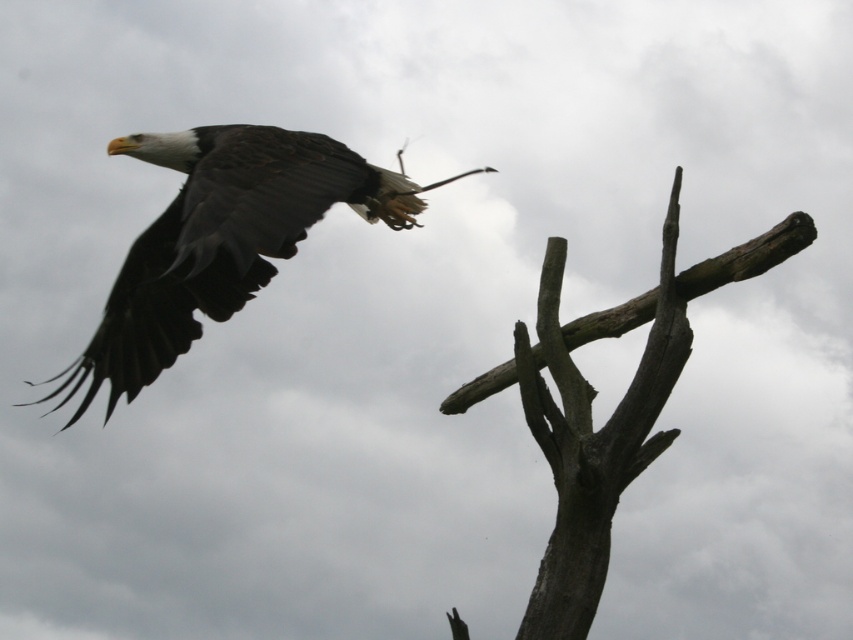
You are a birdwatcher trying to identify the bald eagle in the image. The coordinates given point to a specific feature. What part of the bald eagle is located at point (222, 240)?

The point (222, 240) indicates dark brown feathers at upper left, which are part of the bald eagle.

You are a birdwatcher observing a bald eagle in flight. You notice the dark brown feathers at upper left and the gray rough wood at upper right in the scene. Which object is located to the left of the other?

The dark brown feathers at upper left is positioned on the left side of gray rough wood at upper right.